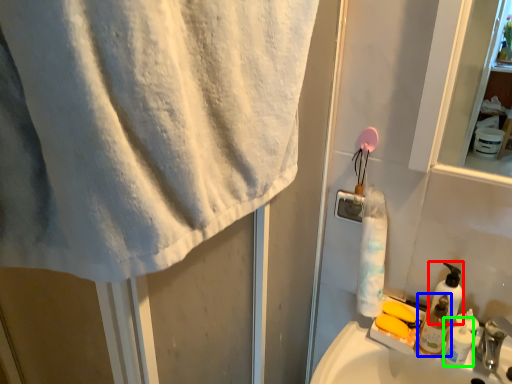
Question: Considering the real-world distances, which object is farthest from soap dispenser (highlighted by a red box)? toiletry (highlighted by a blue box) or shaving cream (highlighted by a green box)?

Choices:
 (A) toiletry
 (B) shaving cream

Answer: (B)